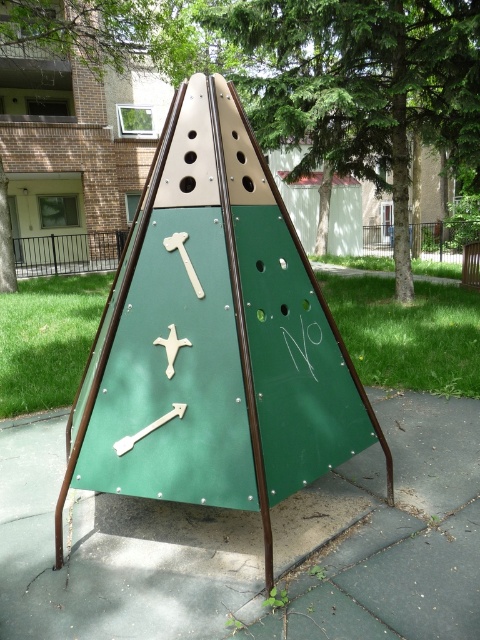
Question: Which object appears farthest from the camera in this image?

Choices:
 (A) green rubber pavement at center
 (B) green matte triangle at center

Answer: (B)

Question: Can you confirm if green matte triangle at center is bigger than green rubber pavement at center?

Choices:
 (A) yes
 (B) no

Answer: (A)

Question: Where is green matte triangle at center located in relation to green rubber pavement at center in the image?

Choices:
 (A) below
 (B) above

Answer: (B)

Question: Which object appears farthest from the camera in this image?

Choices:
 (A) green rubber pavement at center
 (B) green matte triangle at center

Answer: (B)

Question: Is green matte triangle at center positioned behind green rubber pavement at center?

Choices:
 (A) yes
 (B) no

Answer: (A)